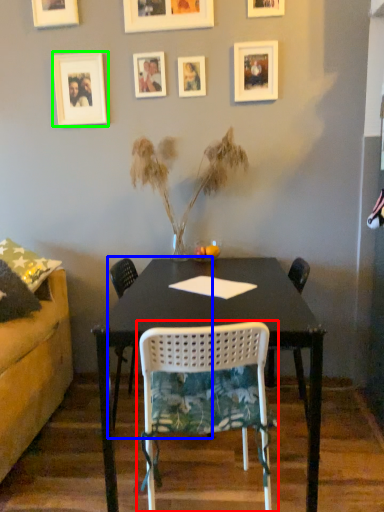
Question: Which object is positioned closest to chair (highlighted by a red box)? Select from chair (highlighted by a blue box) and picture frame (highlighted by a green box).

Choices:
 (A) chair
 (B) picture frame

Answer: (A)